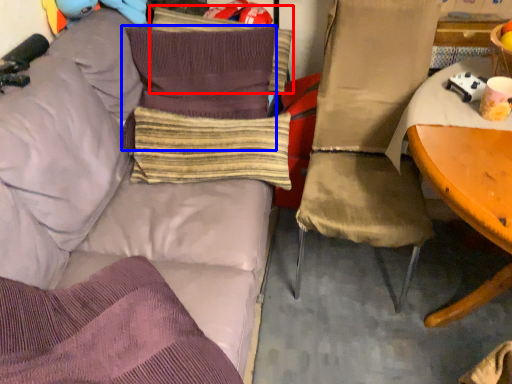
Question: Among these objects, which one is farthest to the camera, pillow (highlighted by a red box) or pillow (highlighted by a blue box)?

Choices:
 (A) pillow
 (B) pillow

Answer: (A)